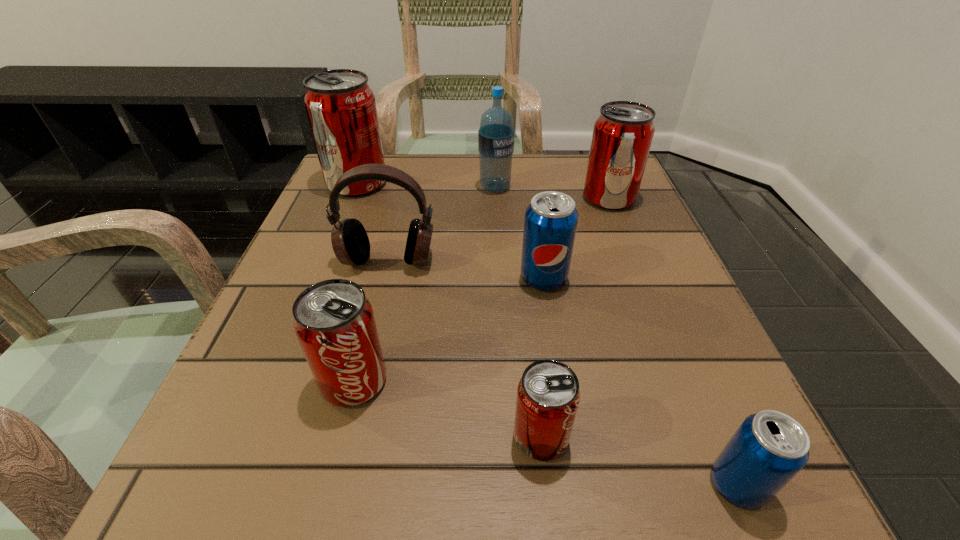
Identify the location of free spot between the farther blue pop soda and the blue water bottle. (519, 233).

The height and width of the screenshot is (540, 960). Find the location of `free space between the smaller blue pop soda and the tallest pop soda`. free space between the smaller blue pop soda and the tallest pop soda is located at coordinates (547, 334).

Find the location of a particular element. The width and height of the screenshot is (960, 540). free point between the tallest pop soda and the blue water bottle is located at coordinates (426, 185).

Find the location of a particular element. The width and height of the screenshot is (960, 540). free space between the black headset and the fourth nearest pop soda is located at coordinates (466, 269).

What are the coordinates of `empty location between the black headset and the smallest red pop soda` in the screenshot? It's located at (465, 349).

The width and height of the screenshot is (960, 540). In order to click on free space that is in between the left blue pop soda and the right blue pop soda in this screenshot , I will do `click(640, 381)`.

The height and width of the screenshot is (540, 960). In order to click on empty space that is in between the tallest pop soda and the fourth nearest pop soda in this screenshot , I will do `click(450, 231)`.

The height and width of the screenshot is (540, 960). What are the coordinates of `vacant space that is in between the biggest red pop soda and the black headset` in the screenshot? It's located at (372, 222).

Point out which object is positioned as the second nearest to the second red pop soda from right to left. Please provide its 2D coordinates. Your answer should be formatted as a tuple, i.e. [(x, y)], where the tuple contains the x and y coordinates of a point satisfying the conditions above.

[(334, 322)]

Select which object is the sixth closest to the biggest red pop soda. Please provide its 2D coordinates. Your answer should be formatted as a tuple, i.e. [(x, y)], where the tuple contains the x and y coordinates of a point satisfying the conditions above.

[(548, 395)]